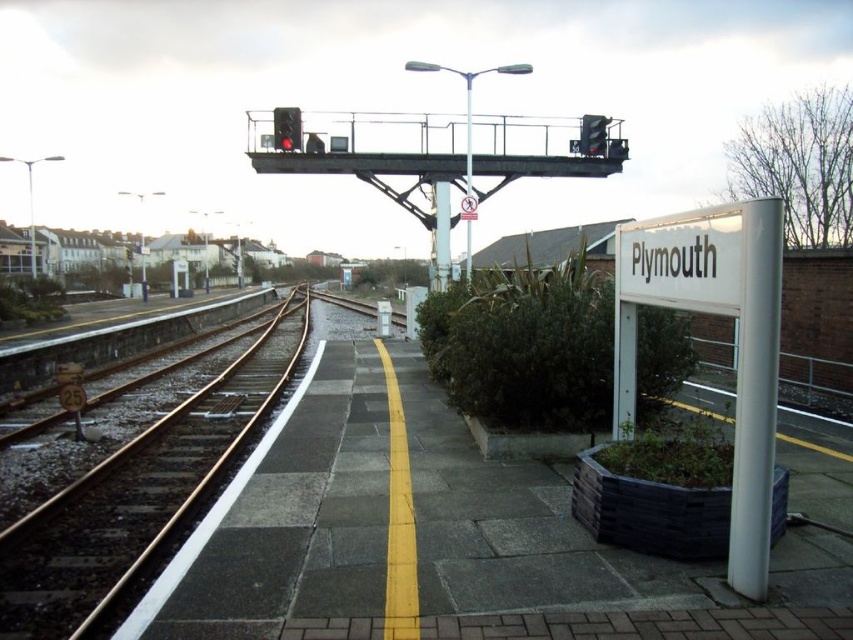
Question: Is smooth metal train track at left bigger than metallic traffic light at upper center?

Choices:
 (A) no
 (B) yes

Answer: (A)

Question: Which object is the farthest from the smooth metal train track at left?

Choices:
 (A) metallic traffic light at upper center
 (B) red glass traffic light at upper center

Answer: (A)

Question: Which point is closer to the camera taking this photo?

Choices:
 (A) click(x=283, y=112)
 (B) click(x=241, y=428)
 (C) click(x=466, y=262)

Answer: (B)

Question: Considering the real-world distances, which object is farthest from the metallic traffic light at upper center?

Choices:
 (A) smooth metal train track at left
 (B) metallic pole at center
 (C) red glass traffic light at upper center
 (D) metallic pole at upper center

Answer: (D)

Question: Can you confirm if metallic pole at upper center is positioned below red glass traffic light at upper center?

Choices:
 (A) yes
 (B) no

Answer: (A)

Question: Where is metallic pole at upper center located in relation to red glass traffic light at upper center in the image?

Choices:
 (A) left
 (B) right

Answer: (B)